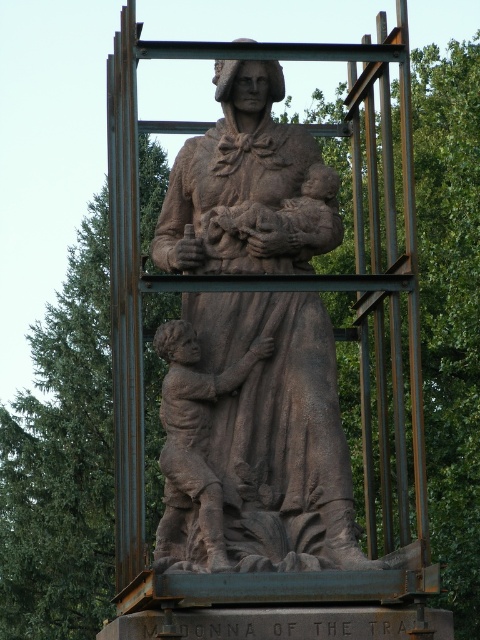
Between point (313, 211) and point (223, 381), which one is positioned behind?

Point (313, 211)

In the scene shown: Measure the distance between point (296, 184) and camera.

328.83 feet

Measure the distance between point (248, 157) and camera.

The distance of point (248, 157) from camera is 325.81 feet.

This screenshot has width=480, height=640. Find the location of `brown stone statue at center`. brown stone statue at center is located at coordinates (255, 440).